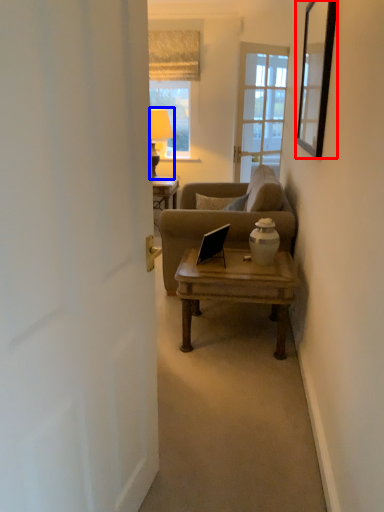
Question: Which of the following is the farthest to the observer, picture frame (highlighted by a red box) or lamp (highlighted by a blue box)?

Choices:
 (A) picture frame
 (B) lamp

Answer: (B)